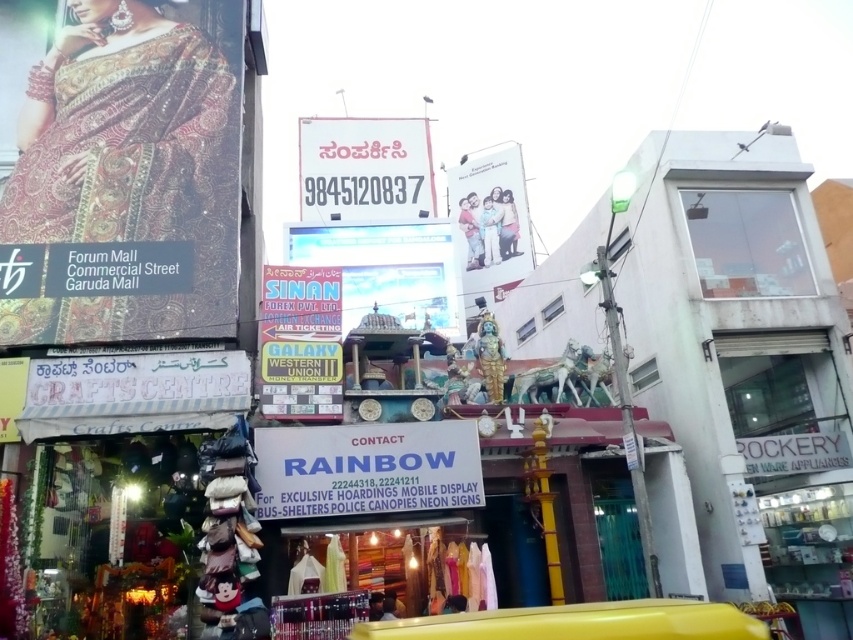
Is white plastic signboard at center to the right of white paper sign at upper center from the viewer's perspective?

Correct, you'll find white plastic signboard at center to the right of white paper sign at upper center.

Does white plastic signboard at center have a smaller size compared to white paper sign at upper center?

No.

Between point (463, 467) and point (370, 131), which one is positioned behind?

The point (370, 131) is more distant.

You are a GUI agent. You are given a task and a screenshot of the screen. Output one action in this format:
    pyautogui.click(x=<x>, y=<y>)
    Task: Click on the white plastic signboard at center
    This screenshot has height=640, width=853.
    Given the screenshot: What is the action you would take?
    pyautogui.click(x=366, y=468)

Is point (399, 317) positioned before point (489, 172)?

Yes, point (399, 317) is in front of point (489, 172).

Is white glossy billboard at center to the left of white glossy family portrait at upper center from the viewer's perspective?

Correct, you'll find white glossy billboard at center to the left of white glossy family portrait at upper center.

Who is more forward, (421, 289) or (480, 284)?

Positioned in front is point (421, 289).

Identify the location of white glossy billboard at center. (386, 269).

From the picture: Who is more forward, (424, 140) or (480, 170)?

Point (424, 140) is in front.

Which is below, white paper sign at upper center or white glossy family portrait at upper center?

white paper sign at upper center

What are the coordinates of `white paper sign at upper center` in the screenshot? It's located at (364, 168).